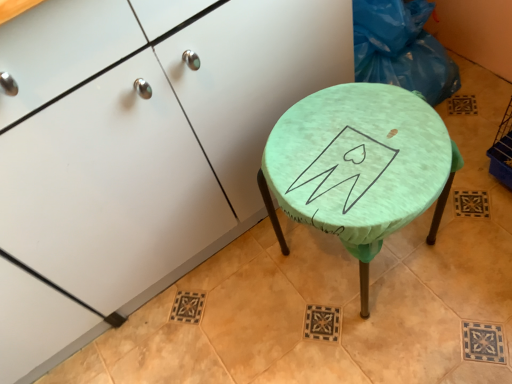
Image resolution: width=512 pixels, height=384 pixels. I want to click on vacant area that is in front of green fabric-covered stool at center, so click(x=418, y=337).